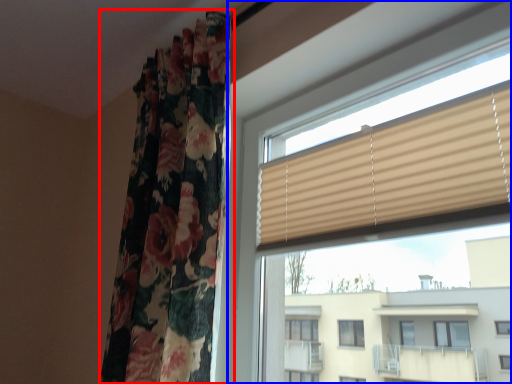
Question: Which point is closer to the camera, curtain (highlighted by a red box) or window (highlighted by a blue box)?

Choices:
 (A) curtain
 (B) window

Answer: (B)